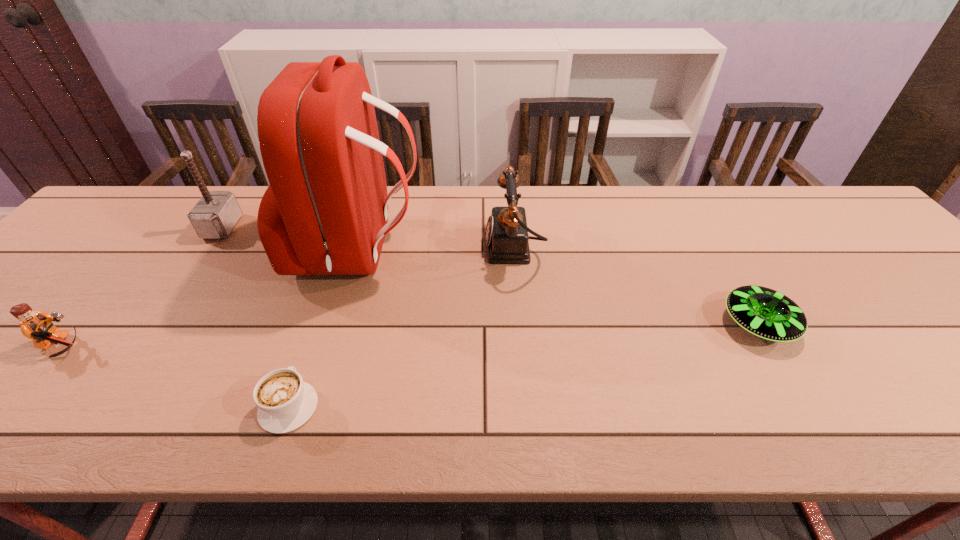
The width and height of the screenshot is (960, 540). What are the coordinates of `backpack located at the far edge` in the screenshot? It's located at (325, 212).

Locate an element on the screen. hammer present at the far edge is located at coordinates (214, 216).

Where is `telephone located in the far edge section of the desktop`? This screenshot has width=960, height=540. telephone located in the far edge section of the desktop is located at coordinates (506, 237).

Identify the location of object at the near edge. (285, 402).

Where is `object present at the left edge`? object present at the left edge is located at coordinates (38, 326).

Where is `vacant area at the far edge`? vacant area at the far edge is located at coordinates (609, 234).

At what (x,y) coordinates should I click in order to perform the action: click on blank area at the near edge. Please return your answer as a coordinate pair (x, y). Image resolution: width=960 pixels, height=540 pixels. Looking at the image, I should click on (553, 420).

In the image, there is a desktop. At what (x,y) coordinates should I click in order to perform the action: click on vacant space at the left edge. Please return your answer as a coordinate pair (x, y). The image size is (960, 540). Looking at the image, I should click on (91, 252).

This screenshot has width=960, height=540. In order to click on vacant space at the right edge in this screenshot , I will do `click(924, 353)`.

Where is `blank space at the far right corner`? blank space at the far right corner is located at coordinates (840, 201).